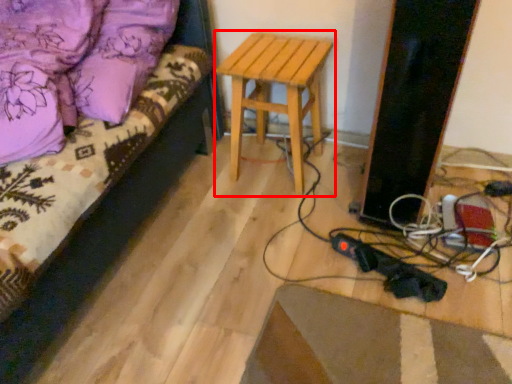
Question: Observing the image, what is the correct spatial positioning of stool (annotated by the red box) in reference to furniture?

Choices:
 (A) left
 (B) right

Answer: (B)